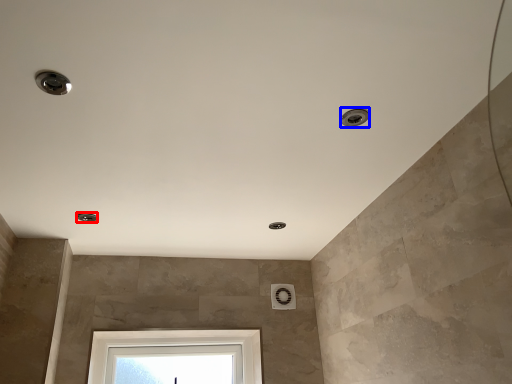
Question: Among these objects, which one is nearest to the camera, droplight (highlighted by a red box) or droplight (highlighted by a blue box)?

Choices:
 (A) droplight
 (B) droplight

Answer: (B)